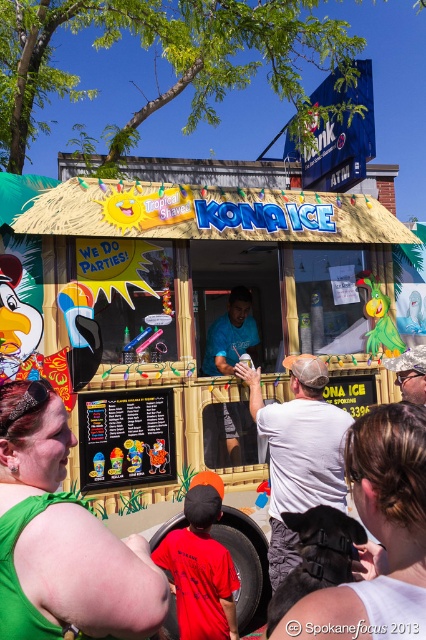
Between matte wooden food truck at center and green fabric dress at lower left, which one is positioned higher?

Positioned higher is matte wooden food truck at center.

Looking at this image, is matte wooden food truck at center wider than green fabric dress at lower left?

Yes, matte wooden food truck at center is wider than green fabric dress at lower left.

Who is more forward, (210, 422) or (66, 458)?

Point (66, 458) is more forward.

At what (x,y) coordinates should I click in order to perform the action: click on matte wooden food truck at center. Please return your answer as a coordinate pair (x, y). Looking at the image, I should click on (189, 316).

At what (x,y) coordinates should I click in order to perform the action: click on green fabric dress at lower left. Please return your answer as a coordinate pair (x, y). The width and height of the screenshot is (426, 640). Looking at the image, I should click on (89, 573).

Describe the element at coordinates (89, 573) in the screenshot. I see `green fabric dress at lower left` at that location.

The image size is (426, 640). Describe the element at coordinates (89, 573) in the screenshot. I see `green fabric dress at lower left` at that location.

At what (x,y) coordinates should I click in order to perform the action: click on green fabric dress at lower left. Please return your answer as a coordinate pair (x, y). This screenshot has height=640, width=426. Looking at the image, I should click on (89, 573).

Does matte wooden food truck at center have a lesser height compared to white matte ice cream at center?

In fact, matte wooden food truck at center may be taller than white matte ice cream at center.

Does point (206, 445) come behind point (311, 481)?

Yes, point (206, 445) is behind point (311, 481).

Locate an element on the screen. The height and width of the screenshot is (640, 426). matte wooden food truck at center is located at coordinates (189, 316).